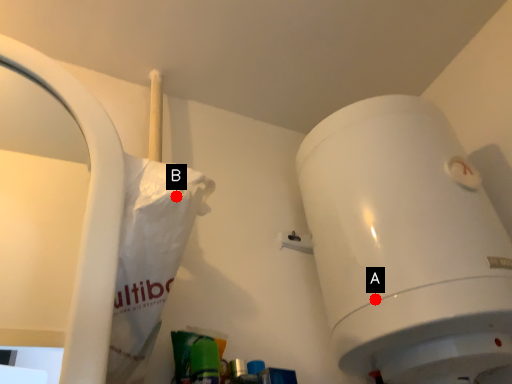
Question: Two points are circled on the image, labeled by A and B beside each circle. Which point is further to the camera?

Choices:
 (A) A is further
 (B) B is further

Answer: (A)